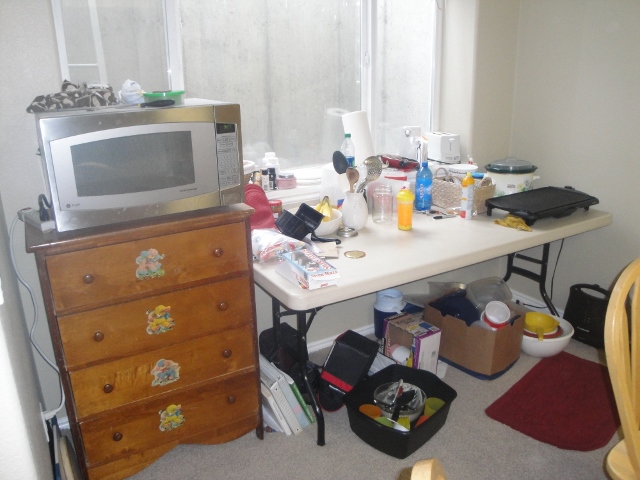
You are a GUI agent. You are given a task and a screenshot of the screen. Output one action in this format:
    pyautogui.click(x=<x>, y=<y>)
    Task: Click on the spoon
    
    Given the screenshot: What is the action you would take?
    pyautogui.click(x=342, y=165), pyautogui.click(x=372, y=169), pyautogui.click(x=348, y=178)